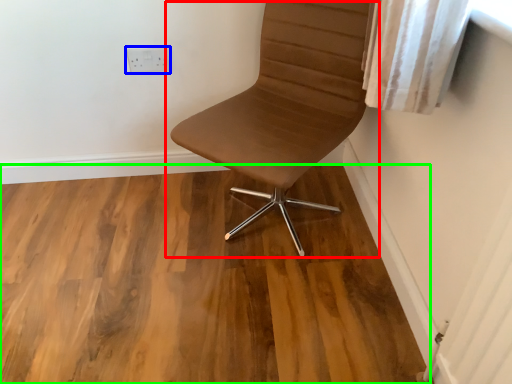
Question: Based on their relative distances, which object is nearer to chair (highlighted by a red box)? Choose from electric outlet (highlighted by a blue box) and hardwood (highlighted by a green box).

Choices:
 (A) electric outlet
 (B) hardwood

Answer: (B)